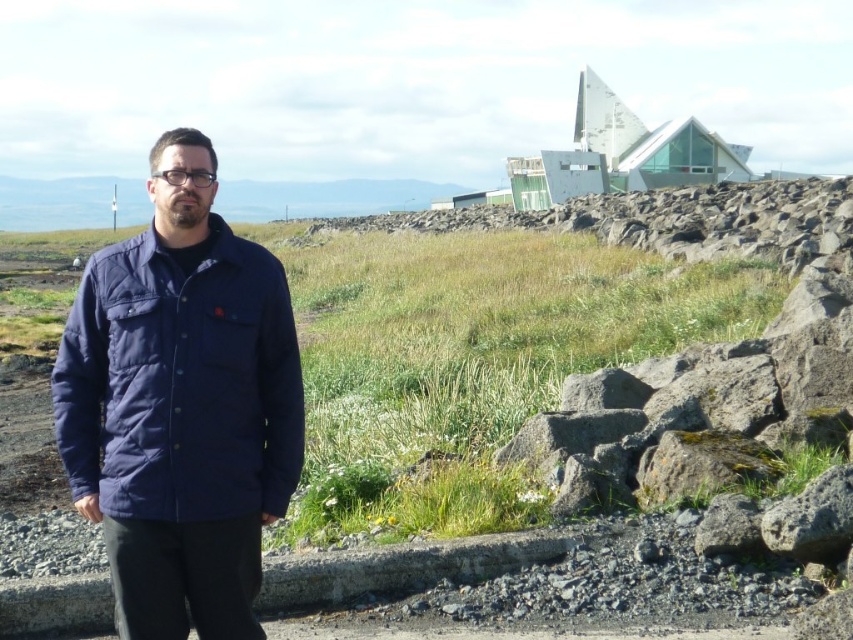
You are a hiker planning to walk from the gray rough rocks at center to the navy blue quilted jacket at center. Given that your average walking speed is 1.5 meters per second, how many seconds will it take you to reach the jacket?

The gray rough rocks at center and navy blue quilted jacket at center are 19.65 meters apart. At a speed of 1.5 meters per second, dividing the distance by the speed gives 19.65 divided by 1.5 equals approximately 13.1 seconds. So it will take about 13.1 seconds to reach the jacket.

You are a photographer trying to capture a landscape shot. You have two points of interest in your viewfinder labeled as point 1 and point 2. Point 1 is at coordinates point (248, 404) and point 2 is at point (721, 506). Based on the scene description, which point is closer to you?

Point (248, 404) is closer to the viewer than point (721, 506).

You are a hiker trying to cross a rocky terrain. You notice gray rough rocks at center and a navy blue quilted jacket at center. Which object is taller and would require more caution when stepping over?

The gray rough rocks at center is taller than the navy blue quilted jacket at center, so you should be more cautious when stepping over the gray rough rocks at center due to their greater height.